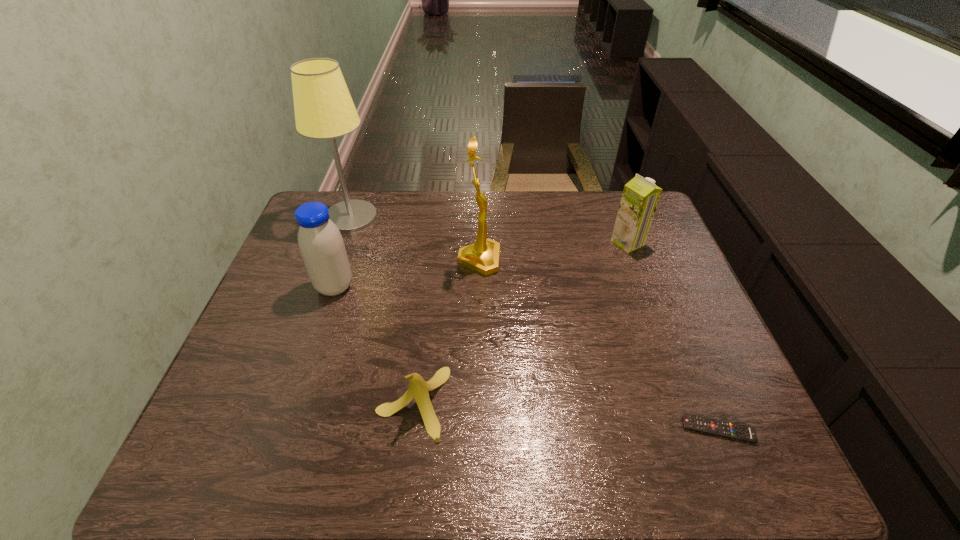
You are a GUI agent. You are given a task and a screenshot of the screen. Output one action in this format:
    pyautogui.click(x=<x>, y=<y>)
    Task: Click on the tallest object
    Image resolution: width=960 pixels, height=540 pixels.
    Given the screenshot: What is the action you would take?
    pyautogui.click(x=324, y=109)

I want to click on the second tallest object, so click(x=483, y=256).

Image resolution: width=960 pixels, height=540 pixels. I want to click on the third object from right to left, so click(483, 256).

Image resolution: width=960 pixels, height=540 pixels. Identify the location of the nearer soya milk. (321, 245).

Find the location of a particular element. The height and width of the screenshot is (540, 960). the right soya milk is located at coordinates (640, 197).

Where is `the third object from left to right`? the third object from left to right is located at coordinates (418, 388).

Locate an element on the screen. This screenshot has height=540, width=960. the second shortest object is located at coordinates (418, 388).

This screenshot has height=540, width=960. I want to click on the shortest object, so click(x=726, y=429).

Locate an element on the screen. The height and width of the screenshot is (540, 960). free space located on the right of the table lamp is located at coordinates (441, 218).

Locate an element on the screen. The image size is (960, 540). free space located 0.340m on the front-facing side of the fourth object from left to right is located at coordinates (614, 260).